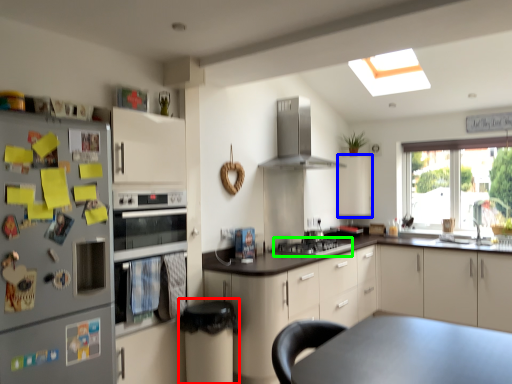
Question: Considering the real-world distances, which object is closest to bar stool (highlighted by a red box)? cabinetry (highlighted by a blue box) or gas stove (highlighted by a green box).

Choices:
 (A) cabinetry
 (B) gas stove

Answer: (B)